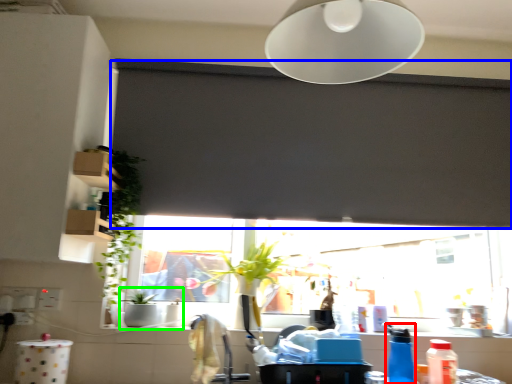
Question: Based on their relative distances, which object is farther from bottle (highlighted by a red box)? Choose from window screen (highlighted by a blue box) and sink (highlighted by a green box).

Choices:
 (A) window screen
 (B) sink

Answer: (B)